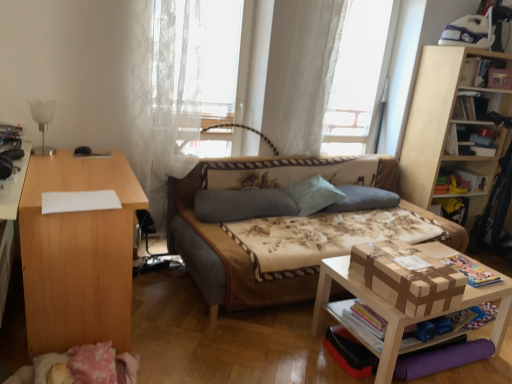
Locate an element on the screen. This screenshot has width=512, height=384. free space in front of white glass lamp at left is located at coordinates (44, 161).